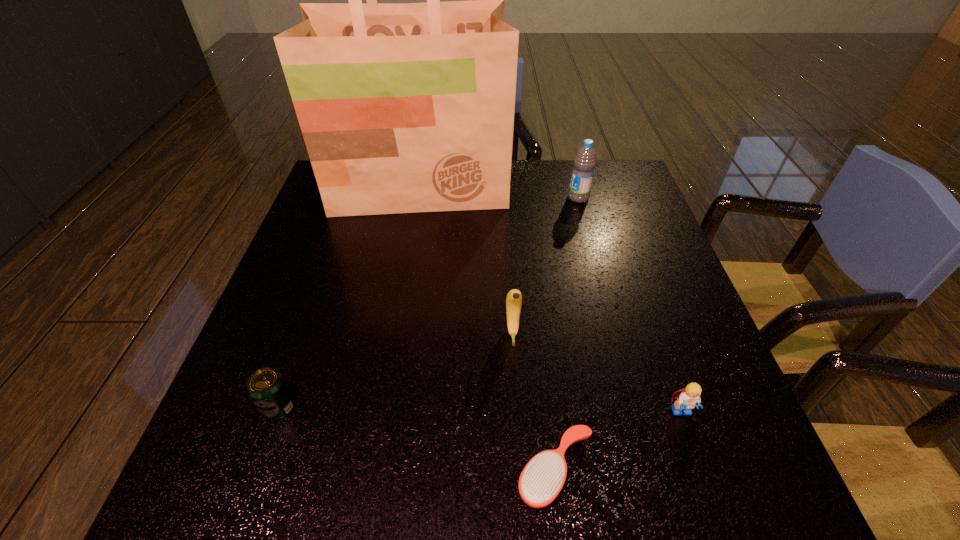
This screenshot has width=960, height=540. I want to click on empty location between the second object from right to left and the beer can, so click(x=429, y=302).

Find the location of a particular element. Image resolution: width=960 pixels, height=540 pixels. free space between the third farthest object and the grocery bag is located at coordinates (467, 260).

I want to click on empty location between the banana and the hairbrush, so click(534, 401).

At what (x,y) coordinates should I click in order to perform the action: click on vacant region between the banana and the beer can. Please return your answer as a coordinate pair (x, y). This screenshot has width=960, height=540. Looking at the image, I should click on (396, 370).

This screenshot has height=540, width=960. Find the location of `free space between the banana and the nearest object`. free space between the banana and the nearest object is located at coordinates (534, 401).

Locate an element on the screen. This screenshot has width=960, height=540. vacant area that lies between the third tallest object and the nearest object is located at coordinates (534, 401).

This screenshot has height=540, width=960. What are the coordinates of `blank region between the third tallest object and the rightmost object` in the screenshot? It's located at (597, 373).

This screenshot has height=540, width=960. Find the location of `vacant space in between the fifth shortest object and the beer can`. vacant space in between the fifth shortest object and the beer can is located at coordinates (429, 302).

Where is `empty space that is in between the tallest object and the Lego`? empty space that is in between the tallest object and the Lego is located at coordinates (551, 300).

Locate an element on the screen. This screenshot has width=960, height=540. object that is the fourth closest to the fourth nearest object is located at coordinates (267, 388).